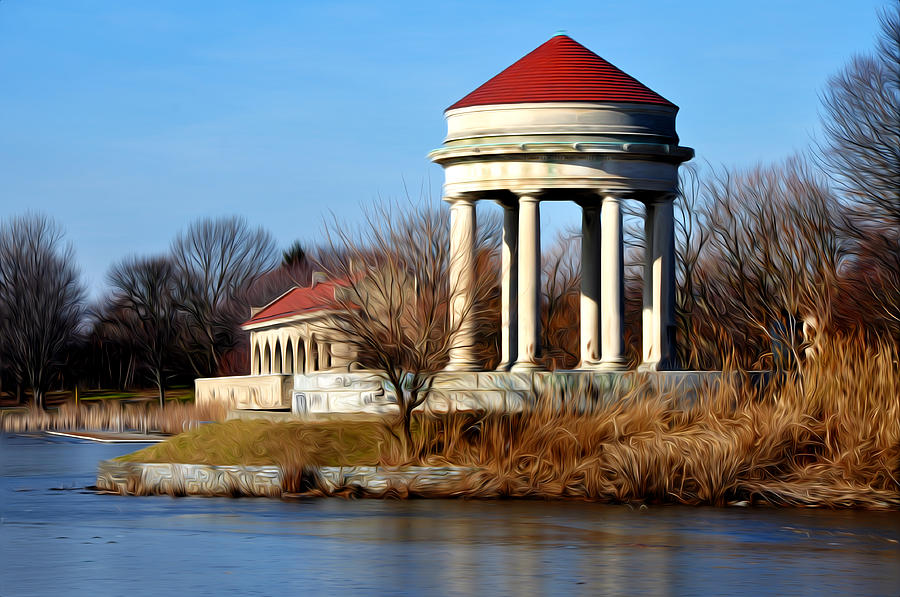
Where is `entrance`? Image resolution: width=900 pixels, height=597 pixels. entrance is located at coordinates (290, 396).